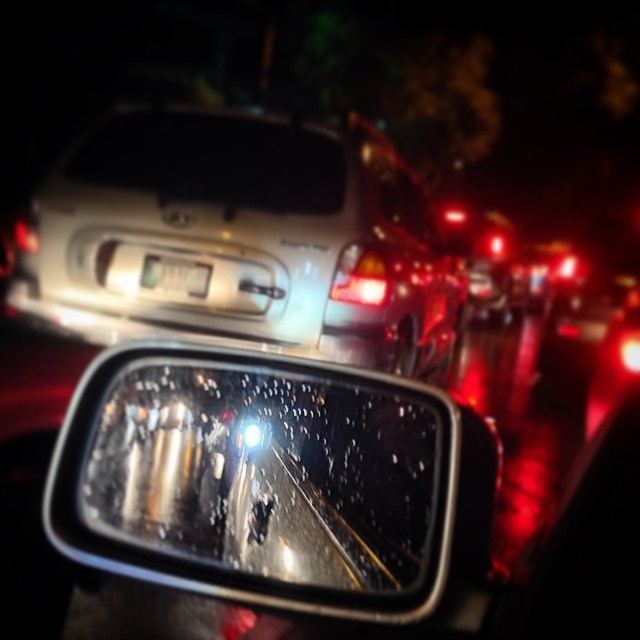
You are driving at night and notice the satin silver sedan at upper center and the white plastic license plate at center in your rearview mirror. Which object appears larger in the mirror?

The satin silver sedan at upper center appears larger than the white plastic license plate at center because it is wider.

Based on the photo, you are a driver checking your rearview mirror and notice two points marked in the reflection. The first point is at coordinates point (344, 385) and the second at point (112, 253). Based on the reflection, which point is closer to your car?

Point (344, 385) is closer to the viewer than point (112, 253), so the first point is closer to your car.

You are driving at night and notice the clear glass mirror at center in your car. Based on its position, can you determine if it is positioned correctly for optimal rearview visibility?

The clear glass mirror at center is located at point (259, 480), which is the standard position for optimal rearview visibility in most vehicles.